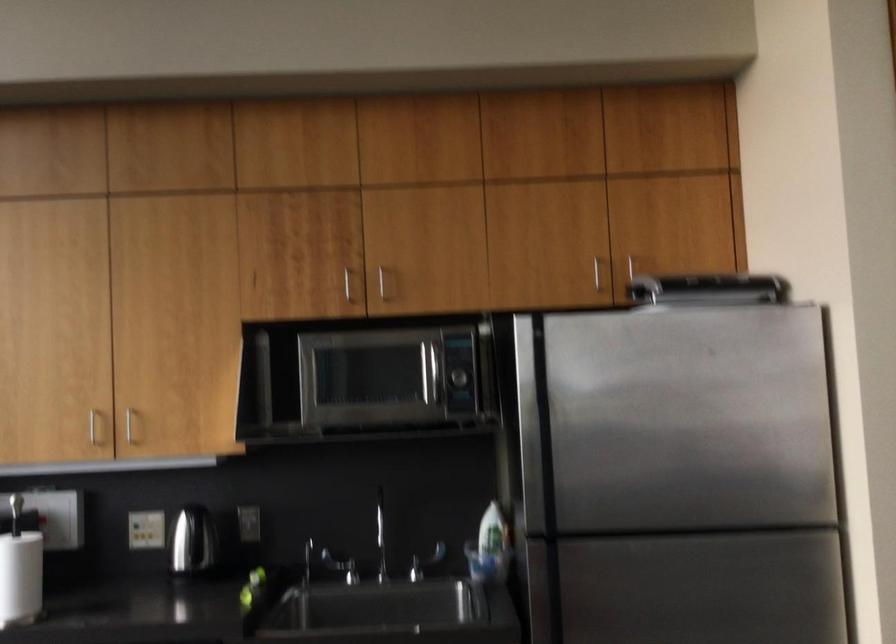
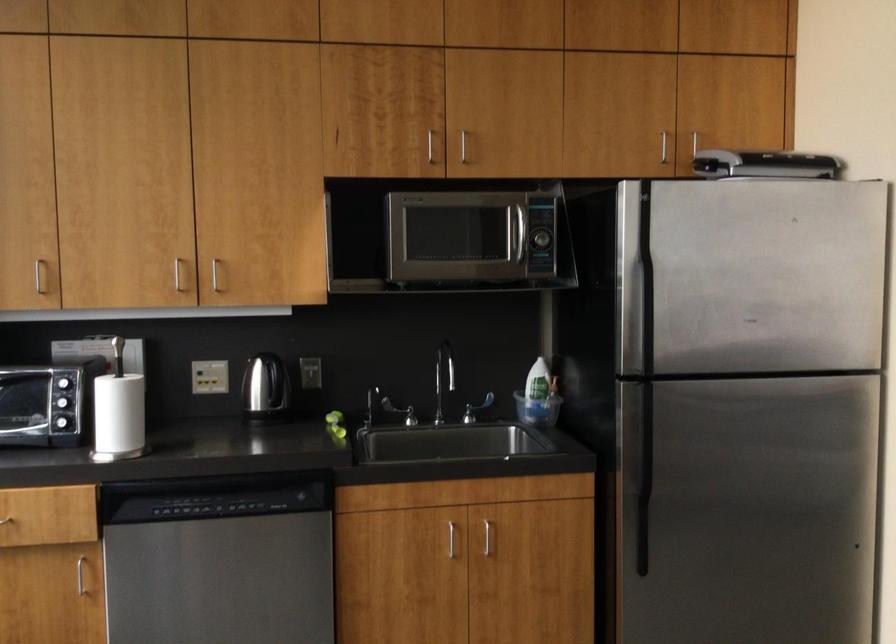
Find the pixel in the second image that matches point 460,375 in the first image.

(540, 239)